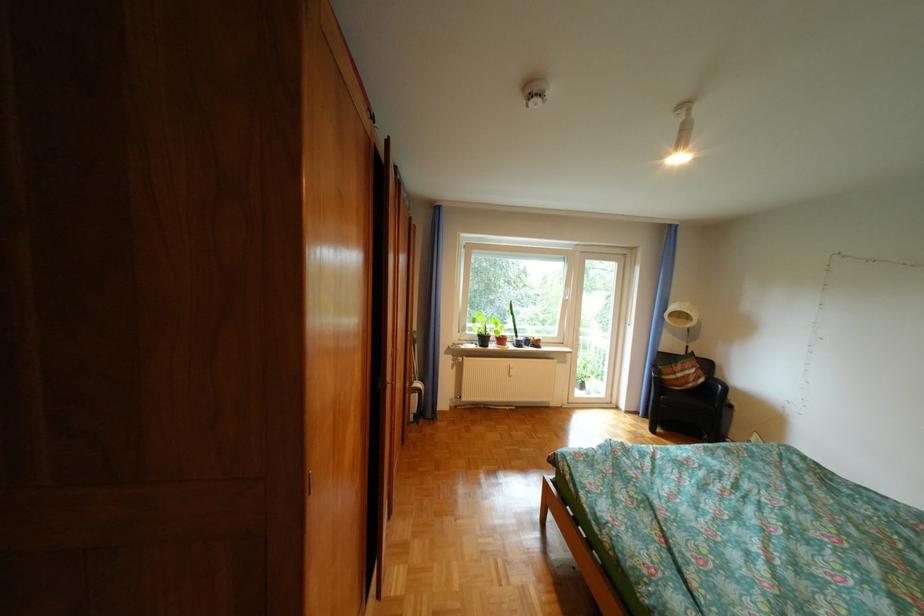
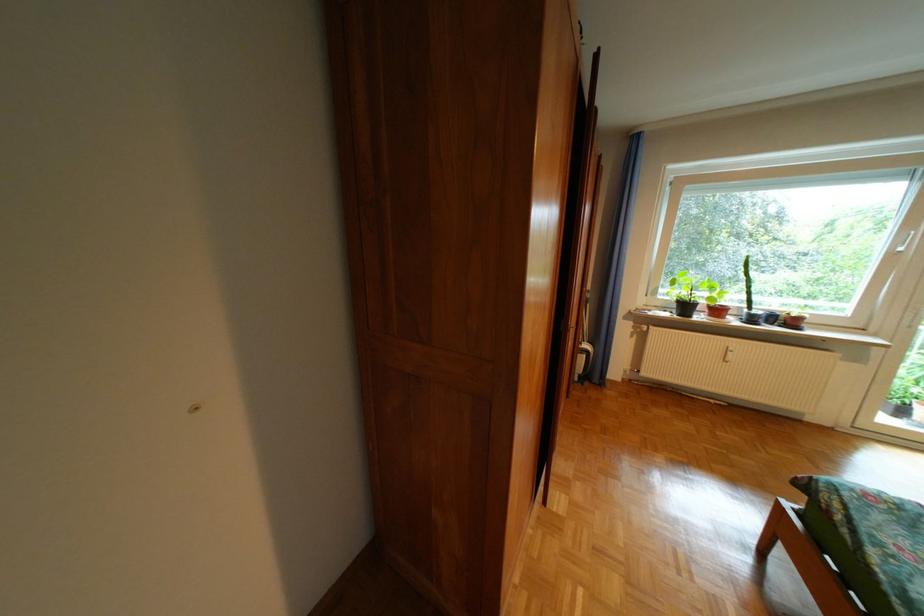
Where in the second image is the point corresponding to (507,347) from the first image?

(714, 318)